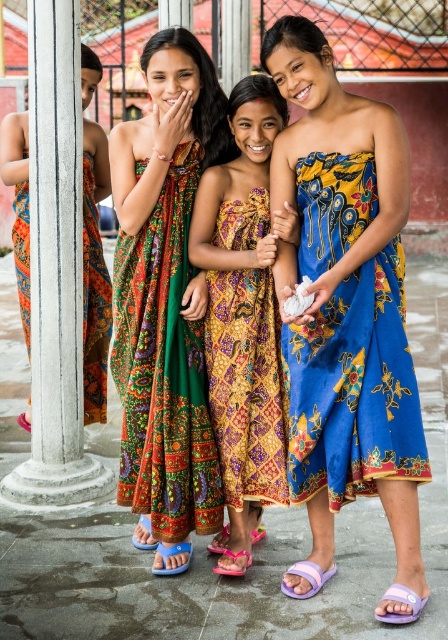
Question: Estimate the real-world distances between objects in this image. Which object is closer to the multicolored batik dress at center?

Choices:
 (A) blue plastic sandal at lower left
 (B) pink fabric sandal at lower center

Answer: (A)

Question: In this image, where is purple fabric sandal at lower center located relative to purple plastic sandal at lower center?

Choices:
 (A) below
 (B) above

Answer: (A)

Question: Where is matte orange dress at left located in relation to pink rubber sandal at lower center in the image?

Choices:
 (A) above
 (B) below

Answer: (A)

Question: Is purple fabric sandal at lower right closer to camera compared to blue rubber sandal at lower left?

Choices:
 (A) no
 (B) yes

Answer: (B)

Question: Among these points, which one is farthest from the camera?

Choices:
 (A) (242, 573)
 (B) (142, 524)

Answer: (B)

Question: Which of these objects is positioned closest to the matte orange dress at left?

Choices:
 (A) blue batik dress at center
 (B) blue rubber sandal at lower left
 (C) purple plastic sandal at lower center
 (D) batik dress at center

Answer: (C)